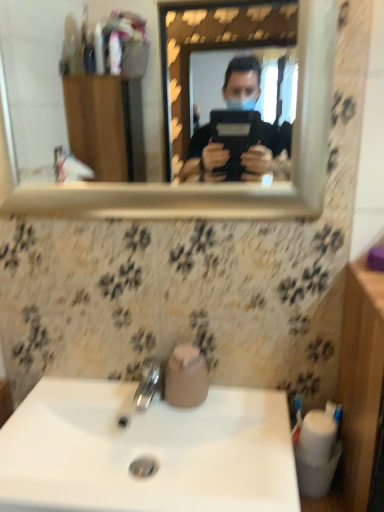
Find the location of a particular element. This screenshot has width=384, height=512. polished chrome tap at center is located at coordinates (143, 391).

From a real-world perspective, is pink matte toilet paper at sink positioned over white glossy sink at lower center based on gravity?

Correct, in the physical world, pink matte toilet paper at sink is higher than white glossy sink at lower center.

From the picture: Is pink matte toilet paper at sink inside or outside of white glossy sink at lower center?

pink matte toilet paper at sink is outside white glossy sink at lower center.

Is pink matte toilet paper at sink in contact with white glossy sink at lower center?

No.

How much distance is there between white glossy sink at lower center and gold-framed mirror at upper center?

white glossy sink at lower center and gold-framed mirror at upper center are 1.36 meters apart.

In terms of height, does white glossy sink at lower center look taller or shorter compared to gold-framed mirror at upper center?

Considering their sizes, white glossy sink at lower center has less height than gold-framed mirror at upper center.

In the scene shown: From the image's perspective, is white glossy sink at lower center on gold-framed mirror at upper center?

No, from the image's perspective, white glossy sink at lower center is not on top of gold-framed mirror at upper center.

Could you tell me if white glossy sink at lower center is turned towards gold-framed mirror at upper center?

No, white glossy sink at lower center is not facing towards gold-framed mirror at upper center.

Is gold-framed mirror at upper center looking in the opposite direction of white glossy sink at lower center?

No.

How different are the orientations of gold-framed mirror at upper center and white glossy sink at lower center in degrees?

There is a 0.0443-degree angle between the facing directions of gold-framed mirror at upper center and white glossy sink at lower center.

Is gold-framed mirror at upper center closer to the viewer compared to white glossy sink at lower center?

No, gold-framed mirror at upper center is further to the viewer.

Is gold-framed mirror at upper center touching white glossy sink at lower center?

No, gold-framed mirror at upper center is not beside white glossy sink at lower center.

From the image's perspective, is white glossy sink at lower center on top of polished chrome tap at center?

No.

In terms of size, does white glossy sink at lower center appear bigger or smaller than polished chrome tap at center?

white glossy sink at lower center is bigger than polished chrome tap at center.

Find the location of a particular element. Image resolution: width=384 pixels, height=512 pixels. tap above the white glossy sink at lower center (from a real-world perspective) is located at coordinates (143, 391).

Is point (266, 488) more distant than point (136, 389)?

No.

The width and height of the screenshot is (384, 512). Find the location of `toilet paper below the gold-framed mirror at upper center (from a real-world perspective)`. toilet paper below the gold-framed mirror at upper center (from a real-world perspective) is located at coordinates (186, 377).

Between point (19, 11) and point (165, 375), which one is positioned in front?

Positioned in front is point (165, 375).

From a real-world perspective, is gold-framed mirror at upper center on pink matte toilet paper at sink?

Yes, from a real-world perspective, gold-framed mirror at upper center is above pink matte toilet paper at sink.

In the scene shown: How many degrees apart are the facing directions of polished chrome tap at center and white glossy sink at lower center?

0.000278 degrees separate the facing orientations of polished chrome tap at center and white glossy sink at lower center.

Considering the relative sizes of polished chrome tap at center and white glossy sink at lower center in the image provided, is polished chrome tap at center thinner than white glossy sink at lower center?

Indeed, polished chrome tap at center has a lesser width compared to white glossy sink at lower center.

Is point (143, 373) closer or farther from the camera than point (169, 420)?

Point (143, 373) is farther from the camera than point (169, 420).

Which of these two, polished chrome tap at center or white glossy sink at lower center, is bigger?

white glossy sink at lower center.

From the image's perspective, who appears lower, pink matte toilet paper at sink or polished chrome tap at center?

polished chrome tap at center.

Would you say pink matte toilet paper at sink is outside polished chrome tap at center?

That's correct, pink matte toilet paper at sink is outside of polished chrome tap at center.

Consider the image. From a real-world perspective, is pink matte toilet paper at sink above or below polished chrome tap at center?

In terms of real-world spatial position, pink matte toilet paper at sink is above polished chrome tap at center.

In order to click on toilet paper that is on the right side of polished chrome tap at center in this screenshot , I will do `click(186, 377)`.

Find the location of `sink beneath the pink matte toilet paper at sink (from a real-world perspective)`. sink beneath the pink matte toilet paper at sink (from a real-world perspective) is located at coordinates (146, 451).

Locate an element on the screen. Image resolution: width=384 pixels, height=512 pixels. sink that is in front of the gold-framed mirror at upper center is located at coordinates (146, 451).

When comparing their distances from gold-framed mirror at upper center, does polished chrome tap at center or pink matte toilet paper at sink seem closer?

Among the two, polished chrome tap at center is located nearer to gold-framed mirror at upper center.

When comparing their distances from polished chrome tap at center, does pink matte toilet paper at sink or gold-framed mirror at upper center seem closer?

Among the two, pink matte toilet paper at sink is located nearer to polished chrome tap at center.

When comparing their distances from pink matte toilet paper at sink, does polished chrome tap at center or gold-framed mirror at upper center seem further?

Based on the image, gold-framed mirror at upper center appears to be further to pink matte toilet paper at sink.

Based on their spatial positions, is polished chrome tap at center or white glossy sink at lower center closer to gold-framed mirror at upper center?

white glossy sink at lower center is positioned closer to the anchor gold-framed mirror at upper center.

From the image, which object appears to be farther from polished chrome tap at center, pink matte toilet paper at sink or white glossy sink at lower center?

white glossy sink at lower center.

Estimate the real-world distances between objects in this image. Which object is further from white glossy sink at lower center, pink matte toilet paper at sink or gold-framed mirror at upper center?

The object further to white glossy sink at lower center is gold-framed mirror at upper center.

When comparing their distances from white glossy sink at lower center, does gold-framed mirror at upper center or polished chrome tap at center seem closer?

Among the two, polished chrome tap at center is located nearer to white glossy sink at lower center.

From the image, which object appears to be farther from polished chrome tap at center, white glossy sink at lower center or gold-framed mirror at upper center?

The object further to polished chrome tap at center is gold-framed mirror at upper center.

You are a GUI agent. You are given a task and a screenshot of the screen. Output one action in this format:
    pyautogui.click(x=<x>, y=<y>)
    Task: Click on the toilet paper between gold-framed mirror at upper center and white glossy sink at lower center in the vertical direction
    This screenshot has width=384, height=512.
    Given the screenshot: What is the action you would take?
    pyautogui.click(x=186, y=377)

This screenshot has width=384, height=512. Identify the location of tap between gold-framed mirror at upper center and white glossy sink at lower center from top to bottom. (143, 391).

You are a GUI agent. You are given a task and a screenshot of the screen. Output one action in this format:
    pyautogui.click(x=<x>, y=<y>)
    Task: Click on the toilet paper that lies between gold-framed mirror at upper center and polished chrome tap at center from top to bottom
    The width and height of the screenshot is (384, 512).
    Given the screenshot: What is the action you would take?
    pyautogui.click(x=186, y=377)

The width and height of the screenshot is (384, 512). Find the location of `tap between white glossy sink at lower center and pink matte toilet paper at sink from front to back`. tap between white glossy sink at lower center and pink matte toilet paper at sink from front to back is located at coordinates (143, 391).